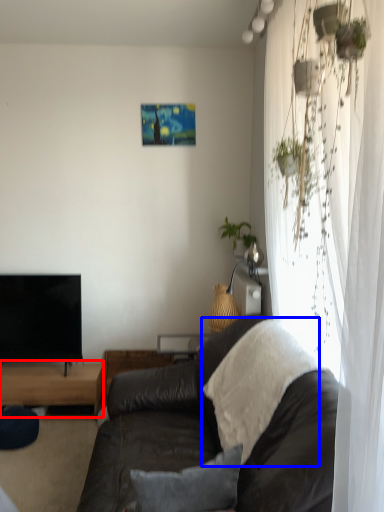
Question: Which object is closer to the camera taking this photo, table (highlighted by a red box) or blanket (highlighted by a blue box)?

Choices:
 (A) table
 (B) blanket

Answer: (B)